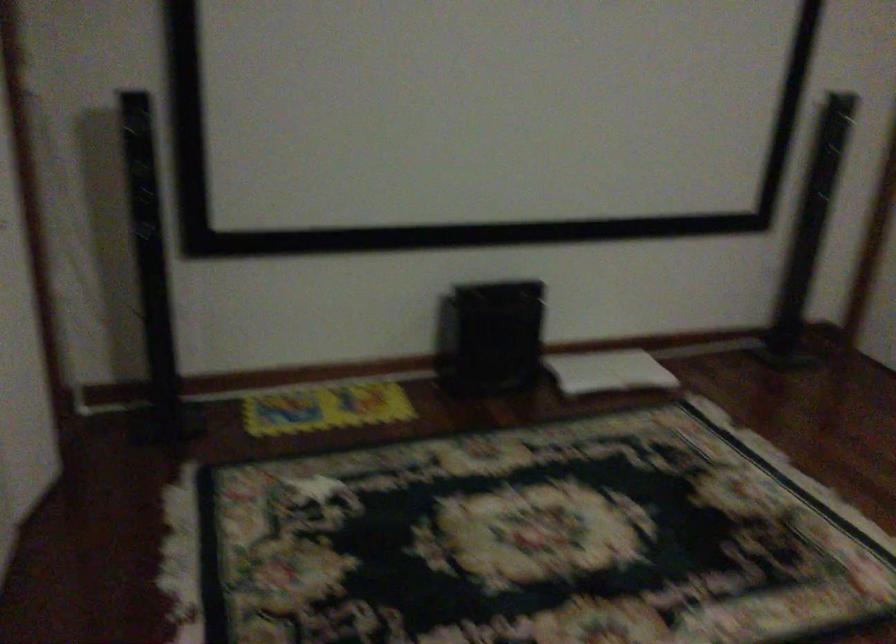
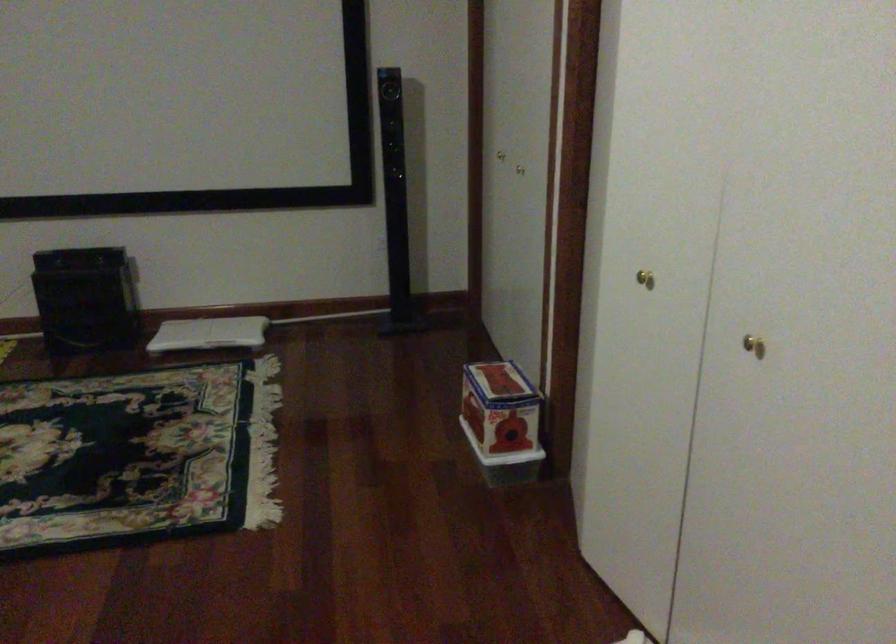
Question: Which direction would the cameraman need to move to produce the second image? Reply with the corresponding letter.

Choices:
 (A) Left
 (B) Right
 (C) Forward
 (D) Backward

Answer: (B)